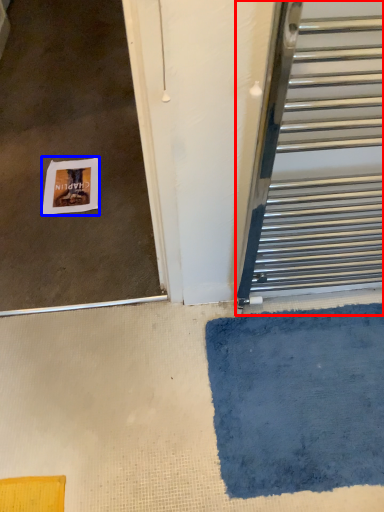
Question: Among these objects, which one is nearest to the camera, door (highlighted by a red box) or postcard (highlighted by a blue box)?

Choices:
 (A) door
 (B) postcard

Answer: (A)